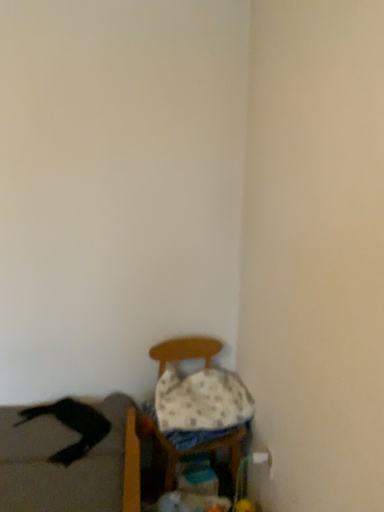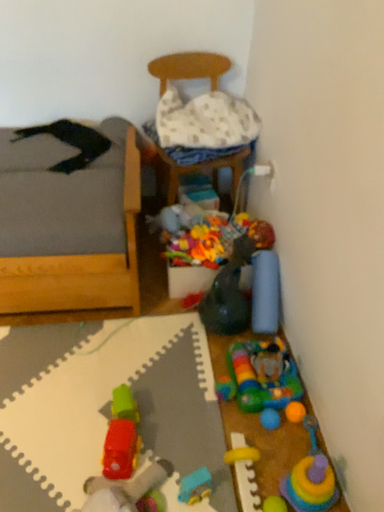
Question: How did the camera likely rotate when shooting the video?

Choices:
 (A) rotated downward
 (B) rotated upward

Answer: (A)